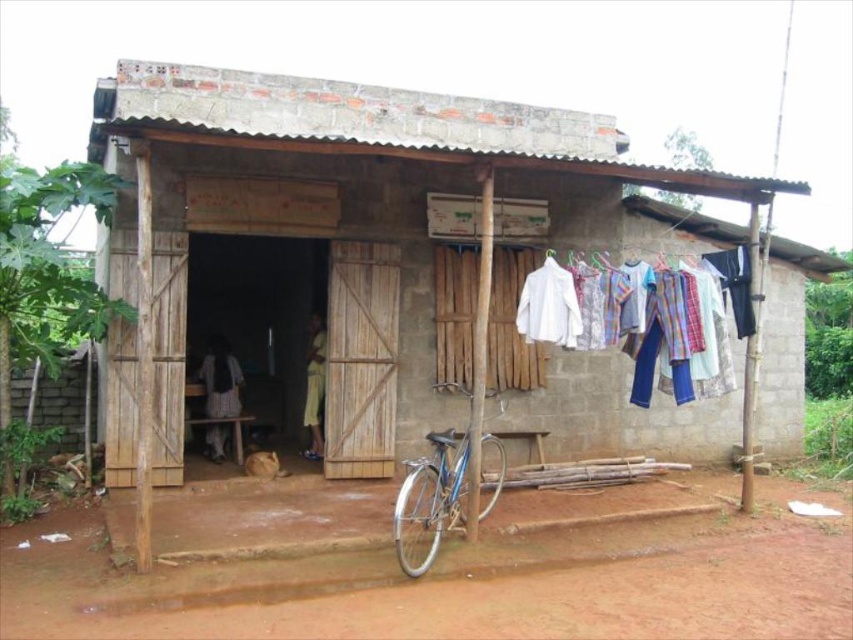
Question: Can you confirm if brown wooden hut at center is thinner than blue metallic bicycle at lower center?

Choices:
 (A) yes
 (B) no

Answer: (A)

Question: Where is brown wooden hut at center located in relation to blue metallic bicycle at lower center in the image?

Choices:
 (A) left
 (B) right

Answer: (A)

Question: Which is farther from the blue metallic bicycle at lower center?

Choices:
 (A) brown wooden hut at center
 (B) white cotton shirts at center

Answer: (A)

Question: Which of the following is the closest to the observer?

Choices:
 (A) (454, 490)
 (B) (695, 333)

Answer: (A)

Question: Which point is farther to the camera?

Choices:
 (A) (558, 289)
 (B) (410, 518)
 (C) (566, 420)

Answer: (C)

Question: Considering the relative positions of brown wooden hut at center and white cotton shirts at center in the image provided, where is brown wooden hut at center located with respect to white cotton shirts at center?

Choices:
 (A) below
 (B) above

Answer: (B)